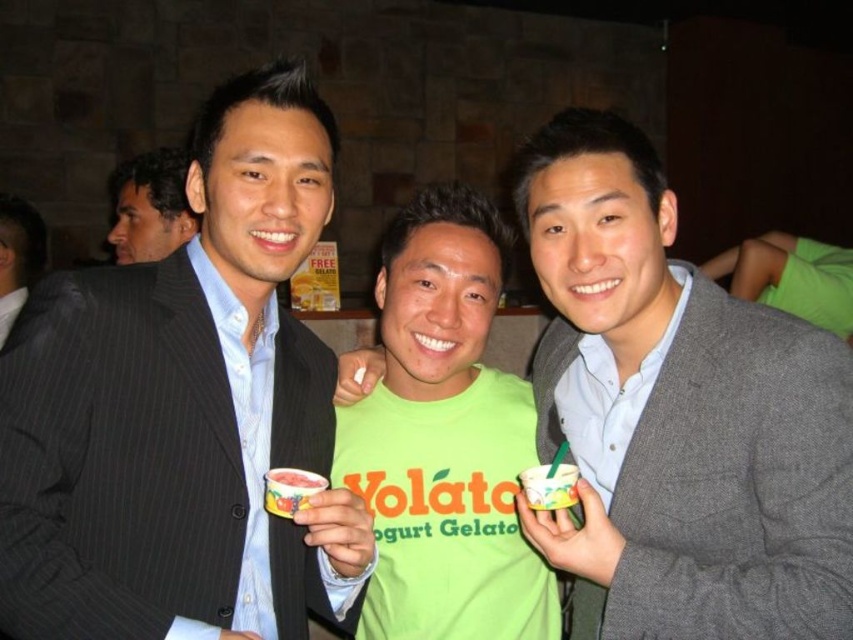
You are a photographer at a yogurt gelato event. You need to capture a photo of the light brown suit at left and the smooth creamy yogurt cup at center. Which object should be placed to the left in the frame?

The light brown suit at left should be placed to the left in the frame since it is positioned on the left side of the smooth creamy yogurt cup at center.